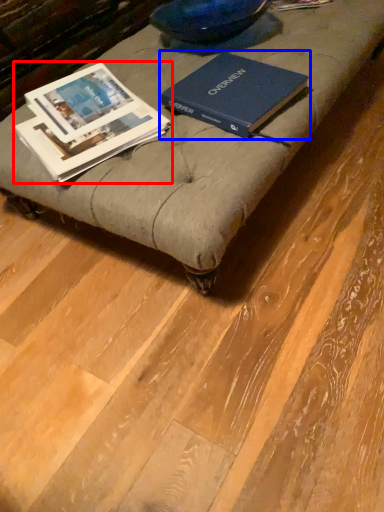
Question: Among these objects, which one is farthest to the camera, book (highlighted by a red box) or book (highlighted by a blue box)?

Choices:
 (A) book
 (B) book

Answer: (B)